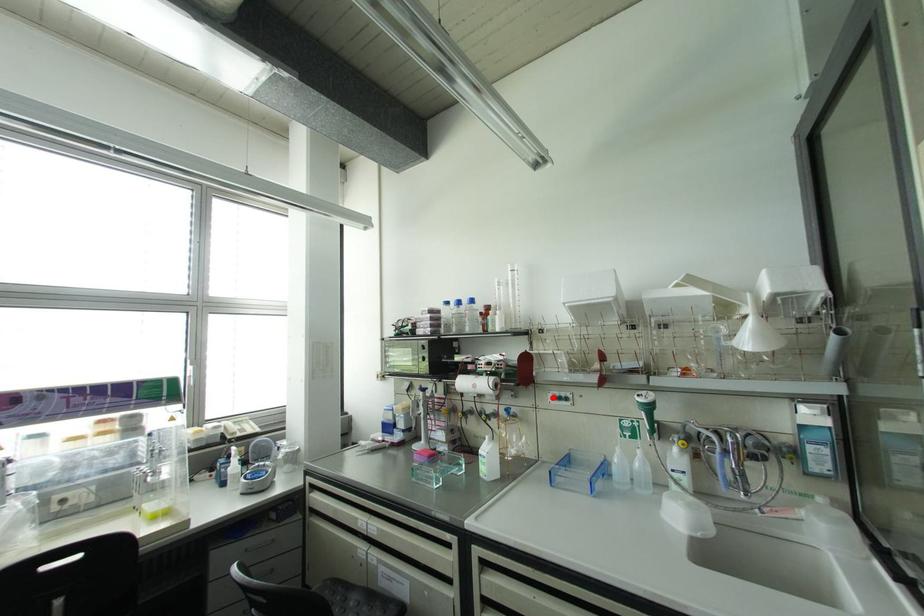
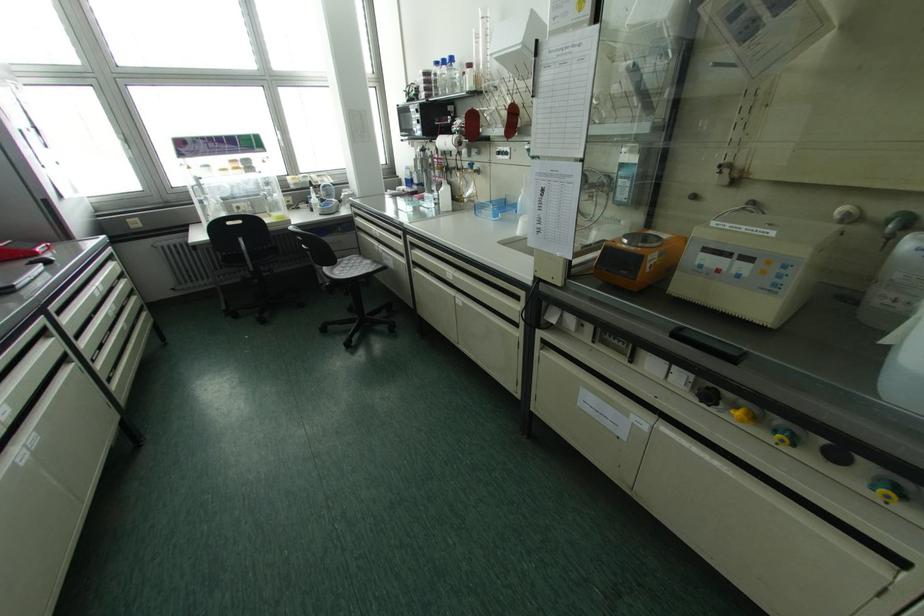
Question: I am providing you with two images of the same scene from different viewpoints. A red point is shown in image1. For the corresponding object point in image2, is it positioned nearer or farther from the camera?

Choices:
 (A) Nearer
 (B) Farther

Answer: (A)